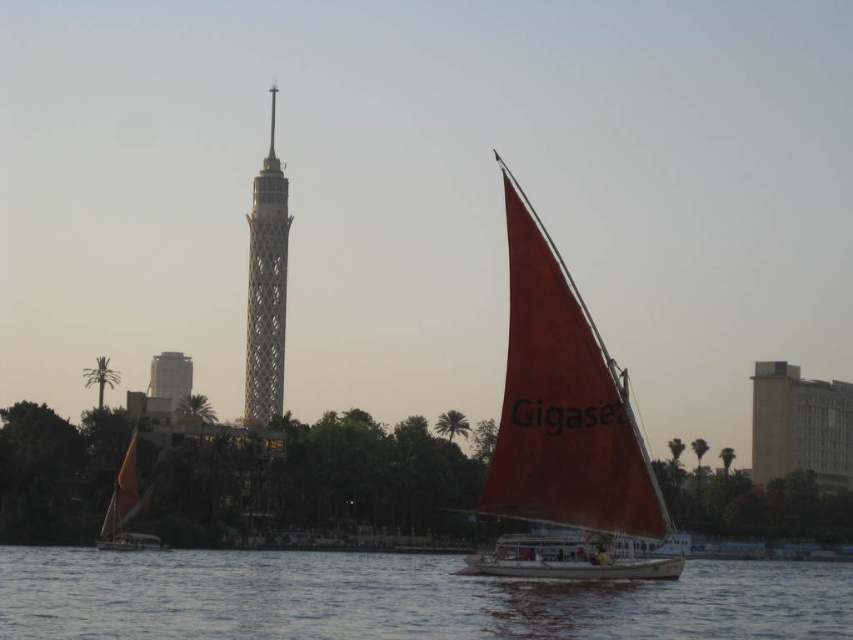
You are a photographer trying to capture the blue water at lower center and the matte red sail at right in the same frame. Based on their positions, which object should you adjust your camera to focus on first to ensure both are in the shot?

The blue water at lower center is positioned on the left side of the matte red sail at right. To capture both in the same frame, focus on the matte red sail at right first since it is on the right and the blue water at lower center is to its left, ensuring both are within the camera view.

You are a photographer planning to capture the blue water at lower center and the metallic lattice tower at center in the same frame. Based on their positions, which object will appear taller in the photograph?

The metallic lattice tower at center will appear taller in the photograph because the blue water at lower center is not as tall as it.